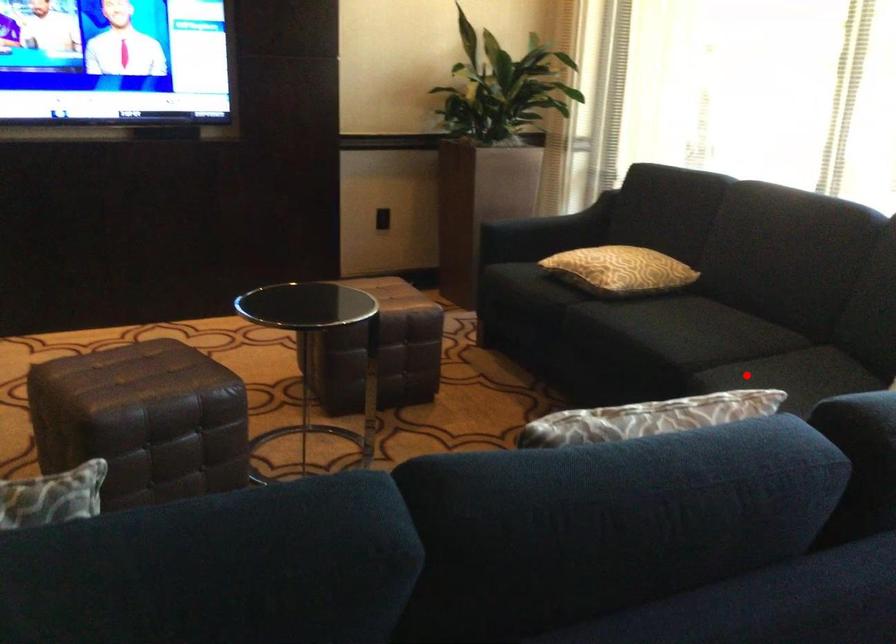
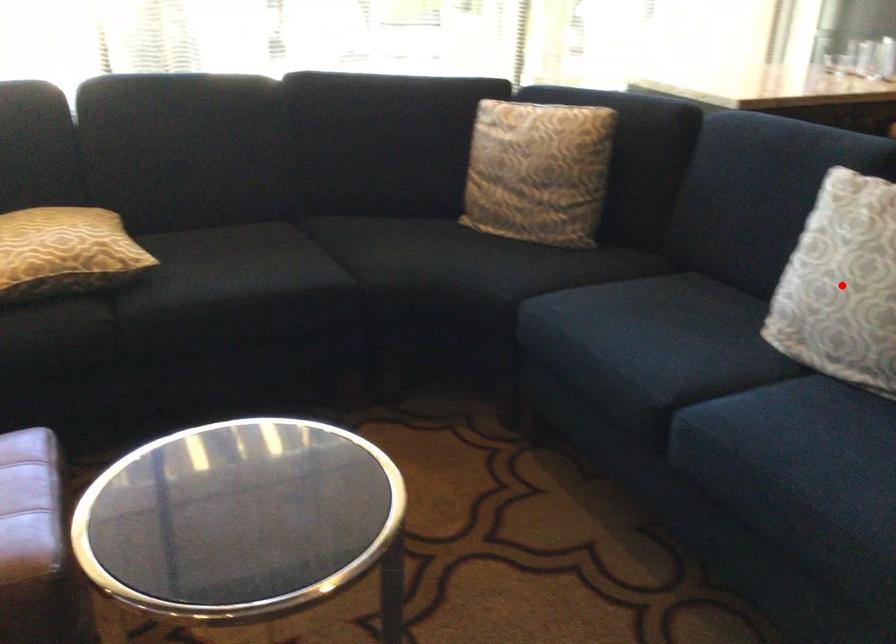
I am providing you with two images of the same scene from different viewpoints. A red point is marked on the first image and another point is marked on the second image. Are the points marked in image1 and image2 representing the same 3D position?

No